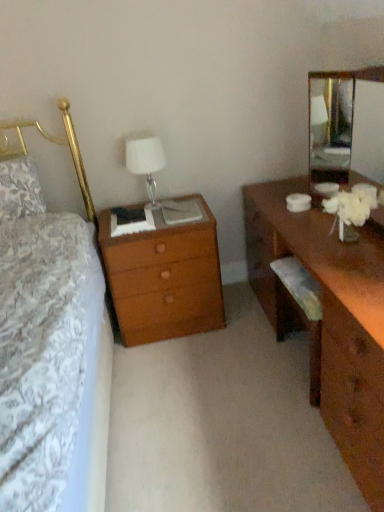
Where is `free location in front of wooden nightstand at left`? free location in front of wooden nightstand at left is located at coordinates (175, 367).